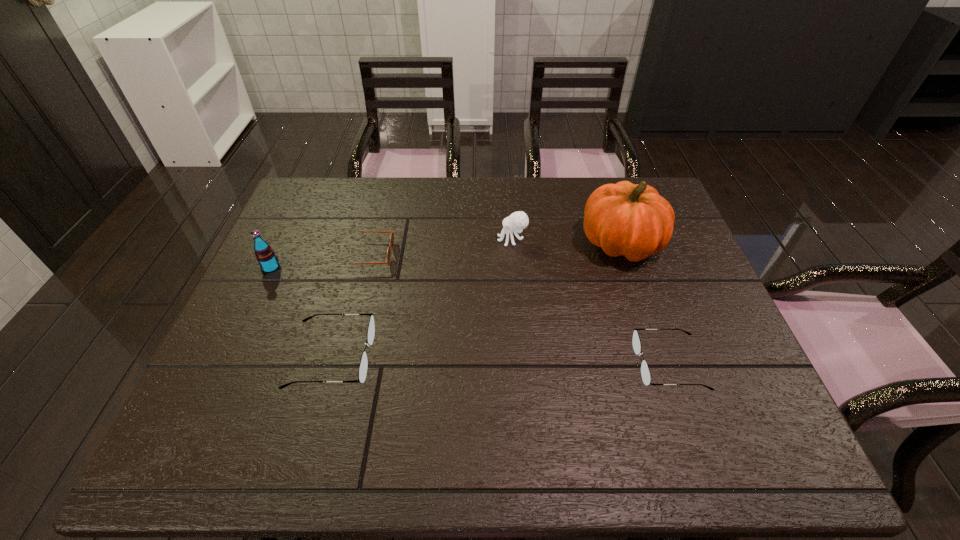
Image resolution: width=960 pixels, height=540 pixels. I want to click on free area in between the tallest object and the fourth object from left to right, so tap(566, 241).

Where is `blank region between the shorter spectacles and the sunglasses`? The image size is (960, 540). blank region between the shorter spectacles and the sunglasses is located at coordinates (518, 309).

Identify the location of unoccupied area between the tallest object and the shorter spectacles. (645, 303).

This screenshot has height=540, width=960. I want to click on free area in between the tallest object and the shorter spectacles, so click(645, 303).

The height and width of the screenshot is (540, 960). I want to click on free space between the left spectacles and the octopus, so click(422, 298).

I want to click on empty space between the sunglasses and the shorter spectacles, so click(x=518, y=309).

Identify the location of free space between the sunglasses and the left spectacles. This screenshot has width=960, height=540. (350, 306).

Where is `vacant space that is in between the third object from right to left and the sunglasses`? The width and height of the screenshot is (960, 540). vacant space that is in between the third object from right to left and the sunglasses is located at coordinates (441, 247).

Find the location of `vacant area that lies between the left spectacles and the leftmost object`. vacant area that lies between the left spectacles and the leftmost object is located at coordinates (301, 312).

Find the location of a particular element. vacant space in between the leftmost object and the third shortest object is located at coordinates (301, 312).